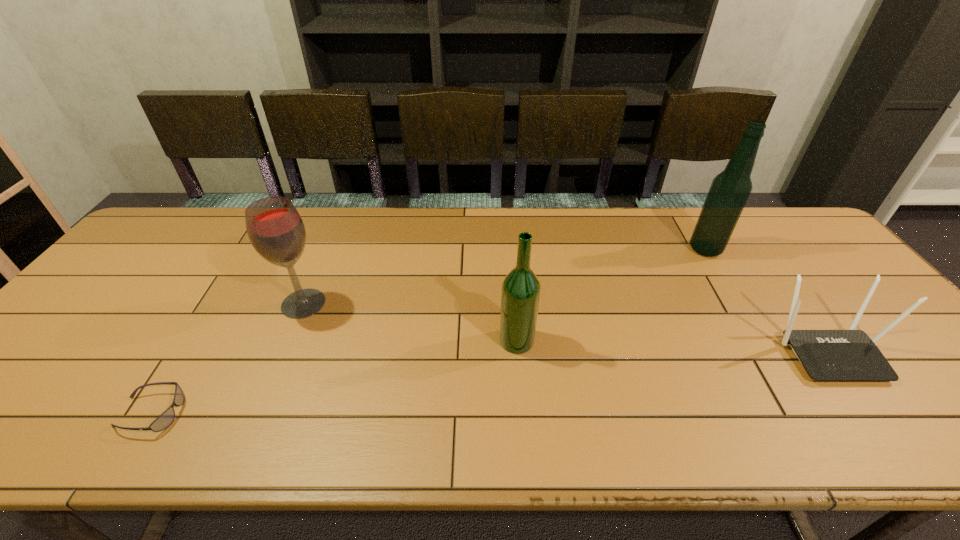
Locate an element on the screen. The height and width of the screenshot is (540, 960). free space located on the right of the second alcohol from left to right is located at coordinates (566, 341).

The height and width of the screenshot is (540, 960). I want to click on free space located 0.050m on the back of the second farthest object, so click(x=315, y=275).

You are a GUI agent. You are given a task and a screenshot of the screen. Output one action in this format:
    pyautogui.click(x=<x>, y=<y>)
    Task: Click on the vacant space located 0.100m on the front-facing side of the fourth tallest object
    The image size is (960, 540).
    Given the screenshot: What is the action you would take?
    pyautogui.click(x=883, y=426)

Identify the location of free space located 0.350m on the lenses of the nearest object. The height and width of the screenshot is (540, 960). (345, 413).

Identify the location of object positioned at the far edge. (730, 189).

Image resolution: width=960 pixels, height=540 pixels. I want to click on object positioned at the near edge, so click(167, 417).

This screenshot has height=540, width=960. Find the location of `object that is at the right edge`. object that is at the right edge is located at coordinates (827, 355).

Identify the location of vacant space at the far edge of the desktop. This screenshot has width=960, height=540. (493, 237).

Find the location of a particular element. This screenshot has height=540, width=960. vacant position at the near edge of the desktop is located at coordinates (448, 426).

Image resolution: width=960 pixels, height=540 pixels. I want to click on free space at the left edge, so click(x=94, y=322).